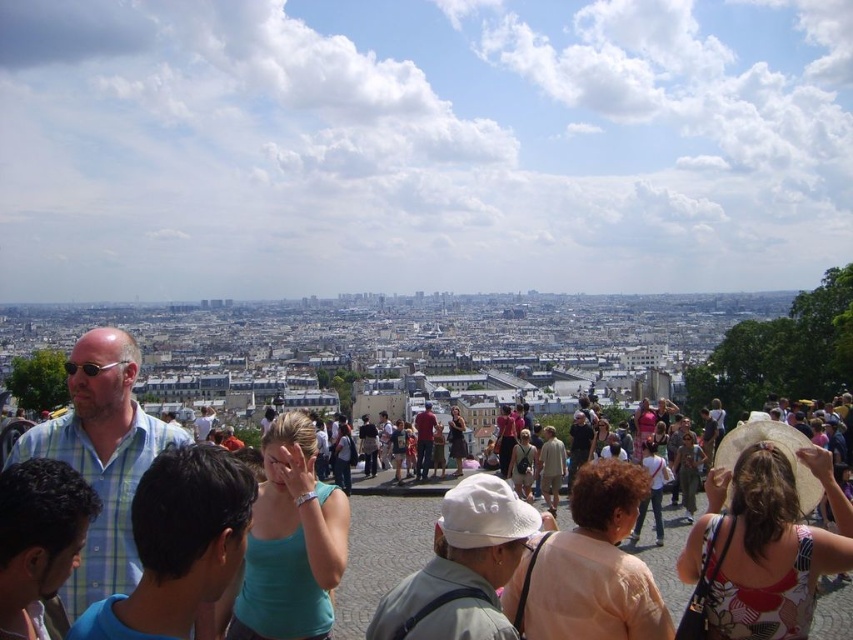
Is white fabric hat at center smaller than matte teal dress at center?

No.

Between point (392, 611) and point (453, 429), which one is positioned in front?

Point (392, 611) is more forward.

The image size is (853, 640). Find the location of `white fabric hat at center`. white fabric hat at center is located at coordinates (462, 568).

Where is `white fabric hat at center`? The image size is (853, 640). white fabric hat at center is located at coordinates (462, 568).

Does light pink cotton dress at center lie in front of teal fabric shirt at center?

Yes, it is in front of teal fabric shirt at center.

Locate an element on the screen. This screenshot has height=640, width=853. light pink cotton dress at center is located at coordinates (651, 492).

Where is `light pink cotton dress at center`? The width and height of the screenshot is (853, 640). light pink cotton dress at center is located at coordinates (651, 492).

Can you confirm if beige cotton hat at center is positioned above matte teal dress at center?

Yes, beige cotton hat at center is above matte teal dress at center.

Does point (555, 465) come closer to viewer compared to point (450, 444)?

That is True.

Is point (538, 470) less distant than point (461, 422)?

Yes, it is in front of point (461, 422).

Image resolution: width=853 pixels, height=640 pixels. I want to click on beige cotton hat at center, so click(550, 467).